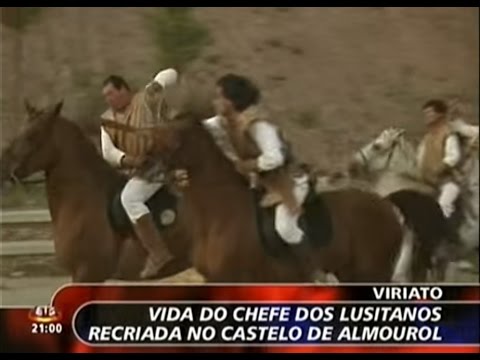
In order to click on wall in this screenshot , I will do `click(281, 60)`.